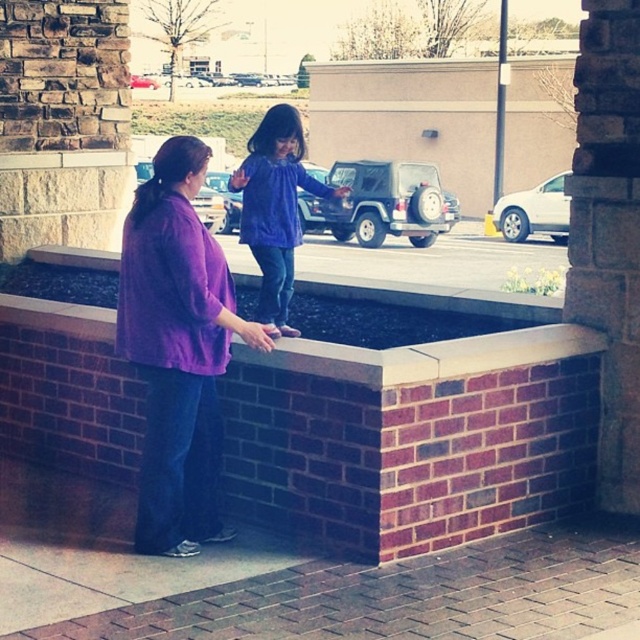
You are a person standing on the paved area. You want to place a small potted plant on the brick ledge at center so that it is visible to someone wearing the purple matte dress at center. Based on the scene, will the potted plant be visible to them?

The brick ledge at center is below the purple matte dress at center, so the potted plant placed there would be visible to the person wearing the purple matte dress at center since it is positioned lower but within their line of sight.

You are standing in the public space and want to place a small flag at the point closer to you between the two points, point (179,419) and point (292,227). Which point should you choose?

Point (179,419) is closer to the camera than point (292,227), so you should choose point (179,419) to place the flag.